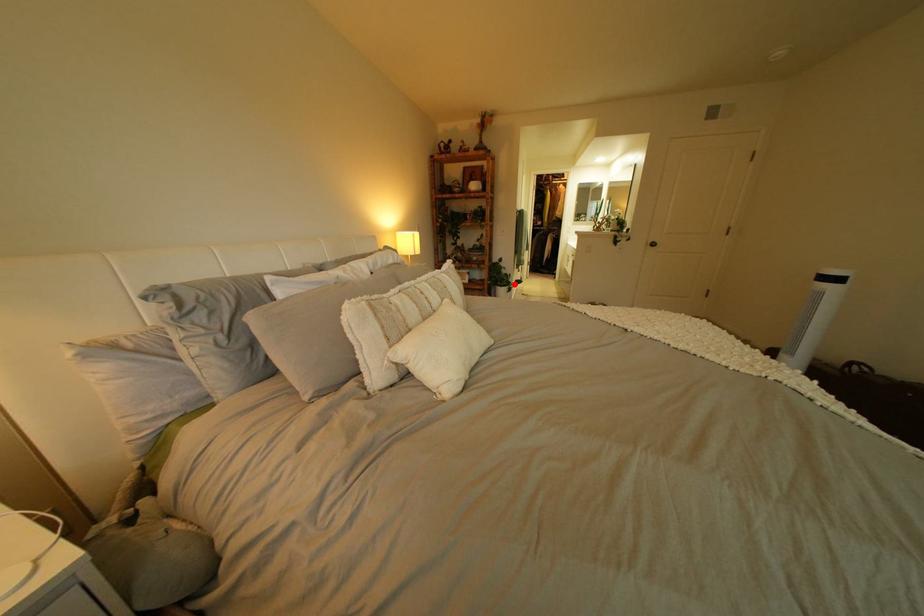
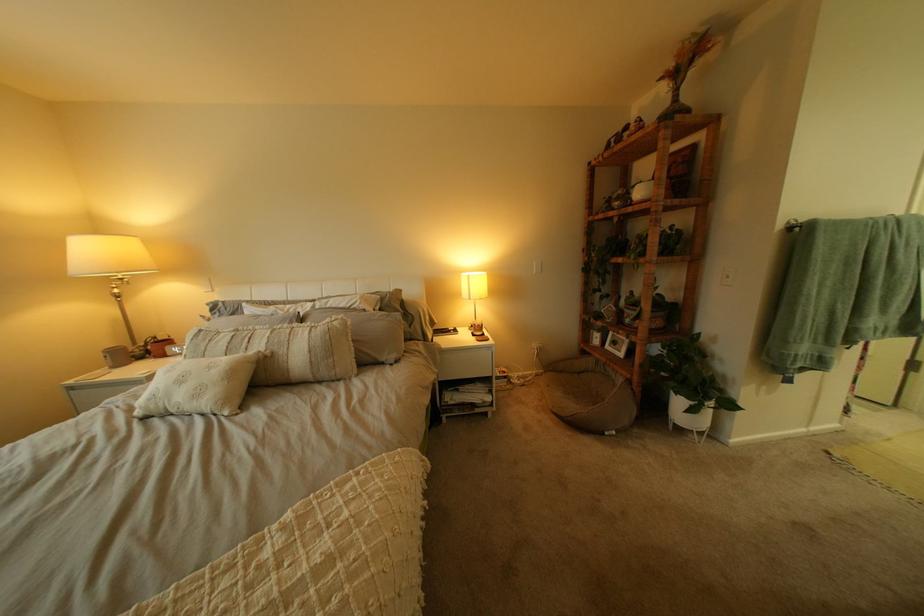
Question: I am providing you with two images of the same scene from different viewpoints. Given a red point in image1, look at the same physical point in image2. Is it:

Choices:
 (A) Closer to the viewpoint
 (B) Farther from the viewpoint

Answer: (B)